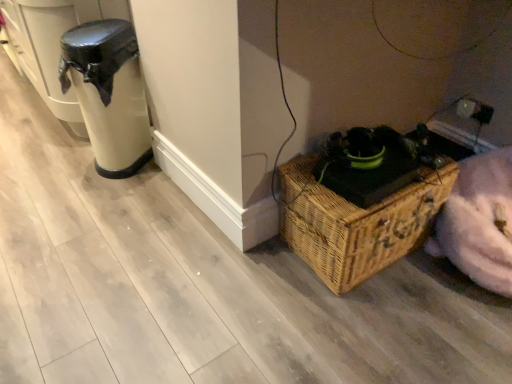
Find the location of a particular element. The width and height of the screenshot is (512, 384). vacant space in front of woven brown picnic basket at lower right is located at coordinates (377, 327).